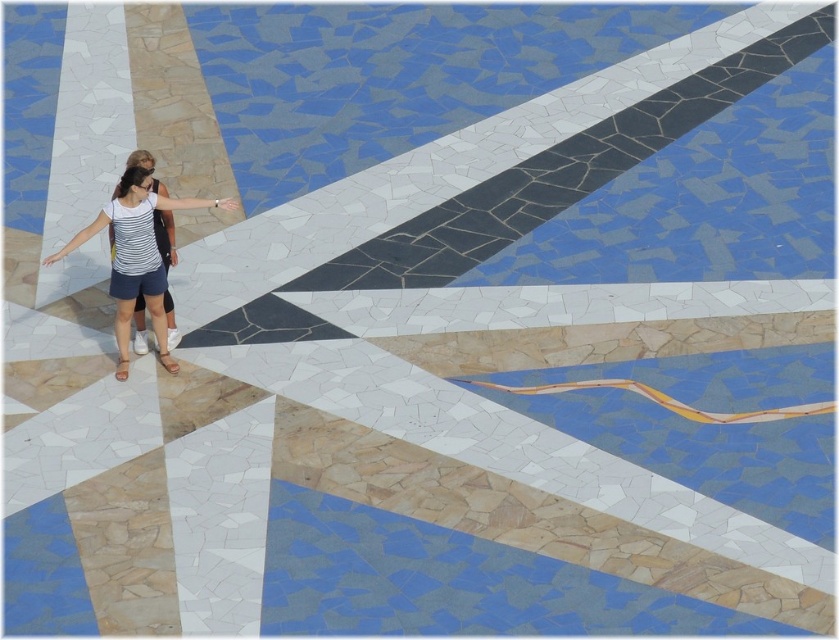
This screenshot has width=839, height=640. What are the coordinates of `striped fabric girl at center` in the screenshot? It's located at (136, 250).

Who is higher up, striped fabric girl at center or light brown leather sandal at lower left?

striped fabric girl at center is above.

Who is more forward, (x=87, y=230) or (x=124, y=364)?

Point (x=87, y=230) is more forward.

The height and width of the screenshot is (640, 839). I want to click on striped fabric girl at center, so click(x=136, y=250).

Between point (170, 362) and point (124, 362), which one is positioned behind?

The point (170, 362) is behind.

This screenshot has width=839, height=640. What do you see at coordinates (167, 362) in the screenshot?
I see `brown leather sandal at lower center` at bounding box center [167, 362].

Which is in front, point (170, 358) or point (126, 372)?

Point (126, 372) is in front.

Locate an element on the screen. The height and width of the screenshot is (640, 839). brown leather sandal at lower center is located at coordinates (167, 362).

Who is shorter, striped fabric girl at center or brown leather sandal at lower center?

With less height is brown leather sandal at lower center.

What do you see at coordinates (136, 250) in the screenshot?
I see `striped fabric girl at center` at bounding box center [136, 250].

The width and height of the screenshot is (839, 640). Identify the location of striped fabric girl at center. (136, 250).

Locate an element on the screen. Image resolution: width=839 pixels, height=640 pixels. striped fabric girl at center is located at coordinates (136, 250).